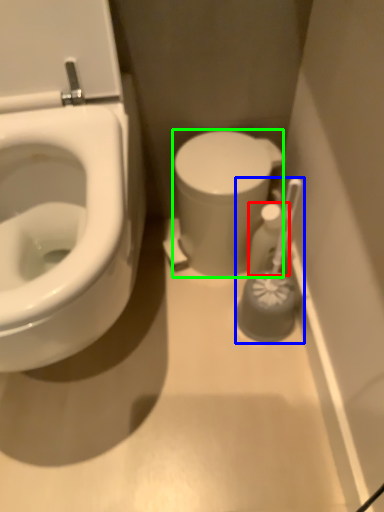
Question: Which object is positioned closest to toiletry (highlighted by a red box)? Select from brush (highlighted by a blue box) and porcelain (highlighted by a green box).

Choices:
 (A) brush
 (B) porcelain

Answer: (A)